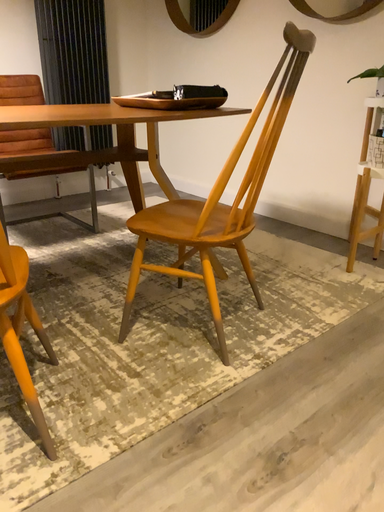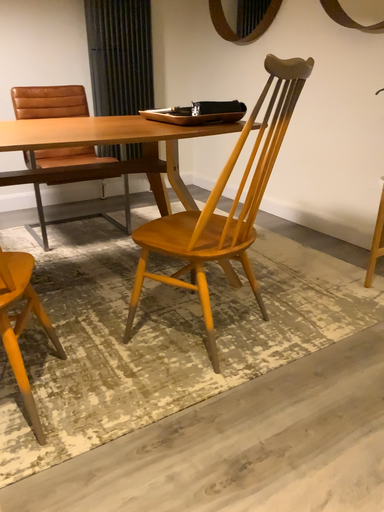
Question: Which way did the camera rotate in the video?

Choices:
 (A) rotated right
 (B) rotated left

Answer: (B)